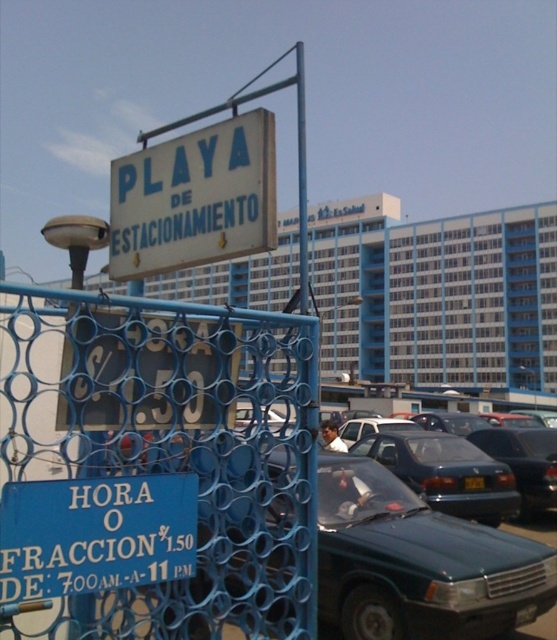
Can you confirm if blue mesh fence at center is shorter than white painted wood sign at upper center?

Incorrect, blue mesh fence at center's height does not fall short of white painted wood sign at upper center's.

In order to click on blue mesh fence at center in this screenshot , I will do `click(154, 467)`.

At what (x,y) coordinates should I click in order to perform the action: click on blue mesh fence at center. Please return your answer as a coordinate pair (x, y). The height and width of the screenshot is (640, 557). Looking at the image, I should click on (154, 467).

Is the position of white painted wood sign at upper center more distant than that of shiny black sedan at center?

No, white painted wood sign at upper center is in front of shiny black sedan at center.

Can you confirm if white painted wood sign at upper center is wider than shiny black sedan at center?

Indeed, white painted wood sign at upper center has a greater width compared to shiny black sedan at center.

Where is `white painted wood sign at upper center`? This screenshot has height=640, width=557. white painted wood sign at upper center is located at coordinates (194, 198).

How far apart are blue mesh fence at center and blue plastic sign at lower left?

They are 21.01 inches apart.

Consider the image. Is blue mesh fence at center above blue plastic sign at lower left?

Actually, blue mesh fence at center is below blue plastic sign at lower left.

You are a GUI agent. You are given a task and a screenshot of the screen. Output one action in this format:
    pyautogui.click(x=<x>, y=<y>)
    Task: Click on the blue mesh fence at center
    
    Given the screenshot: What is the action you would take?
    pyautogui.click(x=154, y=467)